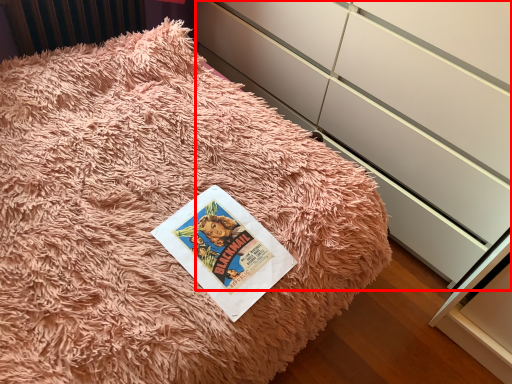
Question: From the image's perspective, where is cabinetry (annotated by the red box) located in relation to paperback book in the image?

Choices:
 (A) below
 (B) above

Answer: (B)